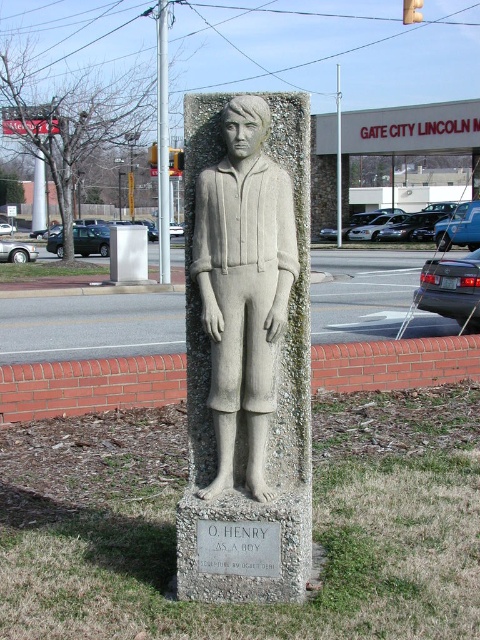
Question: Can you confirm if gray stone statue at center is smaller than gray stone plaque at center?

Choices:
 (A) yes
 (B) no

Answer: (B)

Question: Which point is closer to the camera?

Choices:
 (A) (224, 598)
 (B) (267, 572)

Answer: (B)

Question: Does gray stone statue at center come in front of gray stone plaque at center?

Choices:
 (A) no
 (B) yes

Answer: (B)

Question: Which of the following is the farthest from the observer?

Choices:
 (A) (225, 152)
 (B) (210, 572)

Answer: (A)

Question: Is gray stone statue at center to the left of gray stone plaque at center from the viewer's perspective?

Choices:
 (A) no
 (B) yes

Answer: (A)